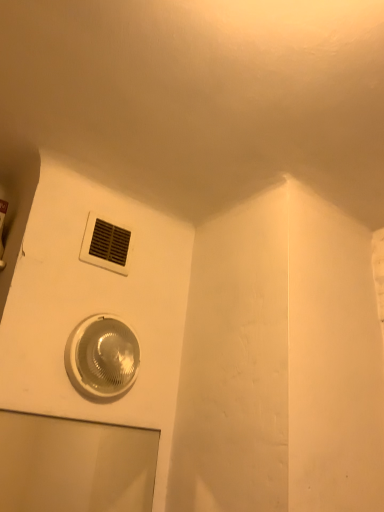
Question: From the image's perspective, is white plastic air conditioning at upper center located above or below translucent plastic light fixture at lower center?

Choices:
 (A) below
 (B) above

Answer: (B)

Question: Considering the positions of white plastic air conditioning at upper center and translucent plastic light fixture at lower center in the image, is white plastic air conditioning at upper center bigger or smaller than translucent plastic light fixture at lower center?

Choices:
 (A) big
 (B) small

Answer: (B)

Question: Estimate the real-world distances between objects in this image. Which object is farther from the white plastic air conditioning at upper center?

Choices:
 (A) transparent glass door at lower left
 (B) translucent plastic light fixture at lower center

Answer: (A)

Question: Estimate the real-world distances between objects in this image. Which object is farther from the white plastic air conditioning at upper center?

Choices:
 (A) translucent plastic light fixture at lower center
 (B) transparent glass door at lower left

Answer: (B)